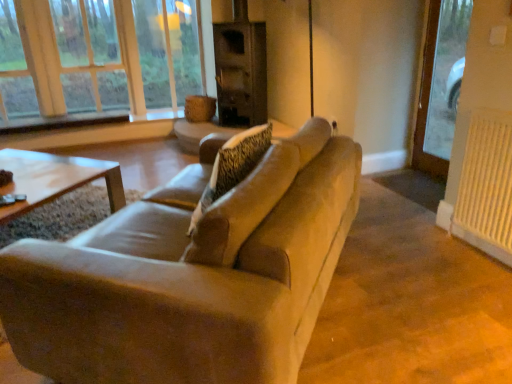
The width and height of the screenshot is (512, 384). Identify the location of free space to the left of white textured radiator at right. (430, 251).